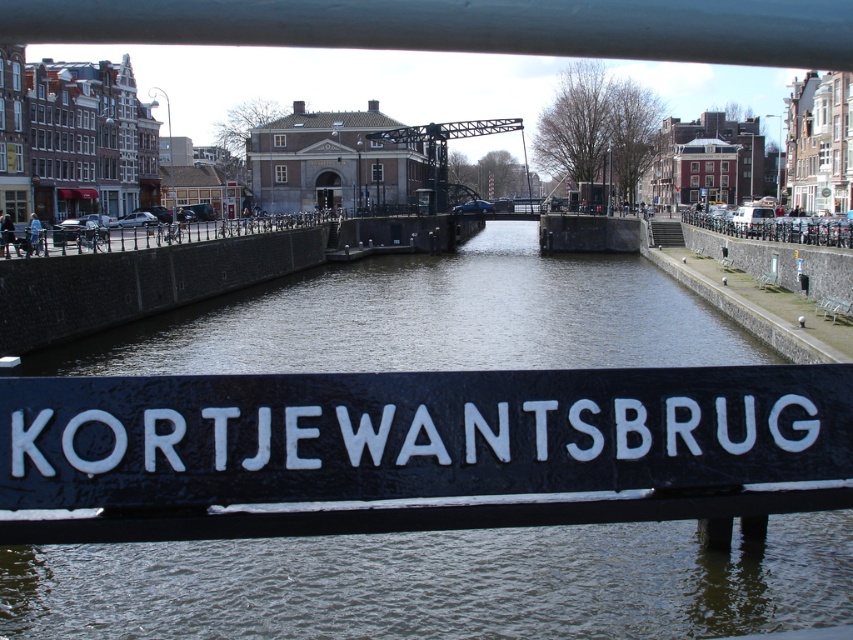
Which is behind, point (0, 632) or point (808, 381)?

Positioned behind is point (0, 632).

Does point (289, 288) come farther from viewer compared to point (172, 390)?

Yes, point (289, 288) is farther from viewer.

You are a GUI agent. You are given a task and a screenshot of the screen. Output one action in this format:
    pyautogui.click(x=<x>, y=<y>)
    Task: Click on the black water at center
    The width and height of the screenshot is (853, 640).
    Given the screenshot: What is the action you would take?
    pyautogui.click(x=436, y=584)